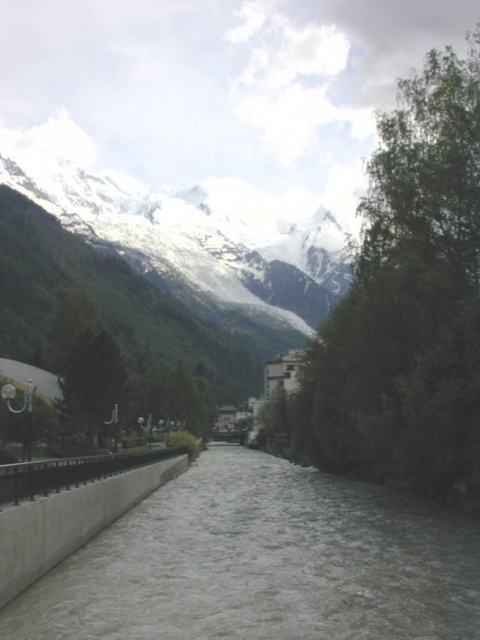
Question: Can you confirm if white concrete river at center is positioned to the right of green leafy tree at upper right?

Choices:
 (A) no
 (B) yes

Answer: (A)

Question: Is the position of white concrete river at center more distant than that of green leafy tree at upper right?

Choices:
 (A) yes
 (B) no

Answer: (B)

Question: Can you confirm if green leafy tree at upper right is positioned to the left of green matte tree at center?

Choices:
 (A) no
 (B) yes

Answer: (A)

Question: Which object is farther from the camera taking this photo?

Choices:
 (A) green leafy tree at upper right
 (B) green matte tree at center
 (C) white concrete river at center

Answer: (B)

Question: Which object appears closest to the camera in this image?

Choices:
 (A) green matte tree at center
 (B) green leafy tree at upper right
 (C) white concrete river at center

Answer: (C)

Question: Which point appears farthest from the camera in this image?

Choices:
 (A) (432, 97)
 (B) (237, 481)
 (C) (60, 385)

Answer: (C)